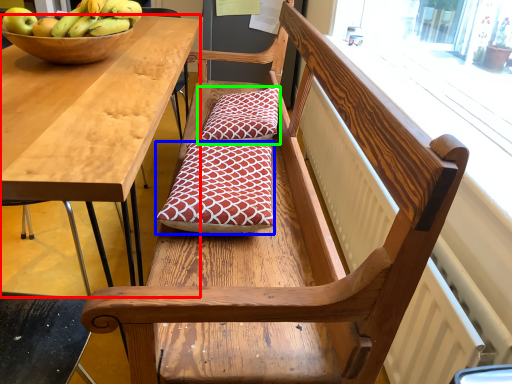
Question: Considering the real-world distances, which object is farthest from desk (highlighted by a red box)? pillow (highlighted by a blue box) or pillow (highlighted by a green box)?

Choices:
 (A) pillow
 (B) pillow

Answer: (B)